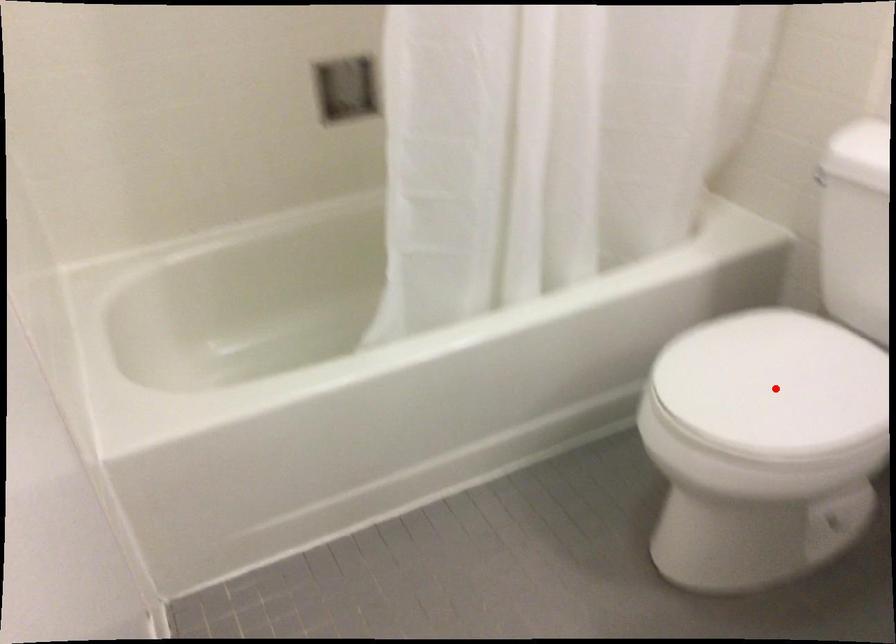
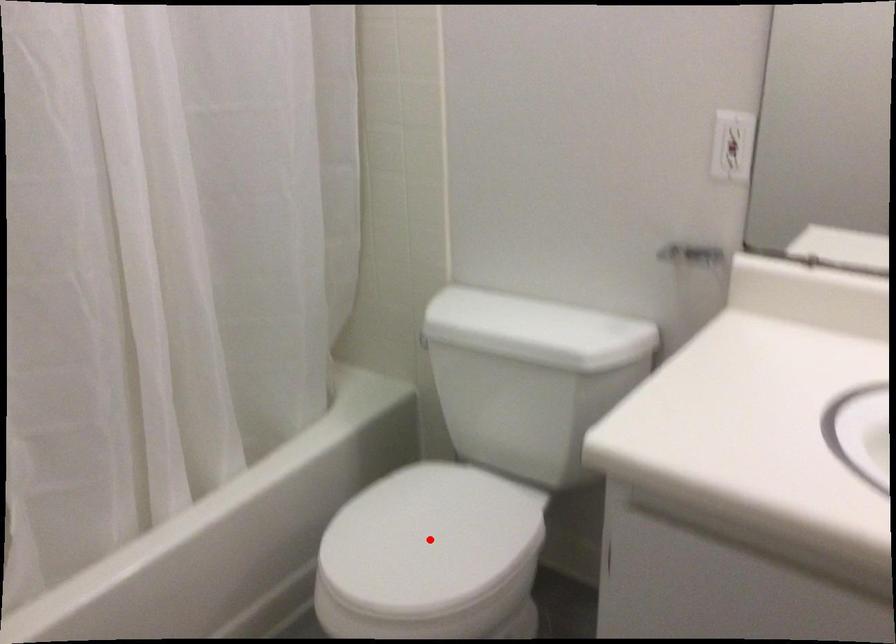
In the scene shown: I am providing you with two images of the same scene from different viewpoints. A red point is marked on the first image and another point is marked on the second image. Is the marked point in image1 the same physical position as the marked point in image2?

Yes